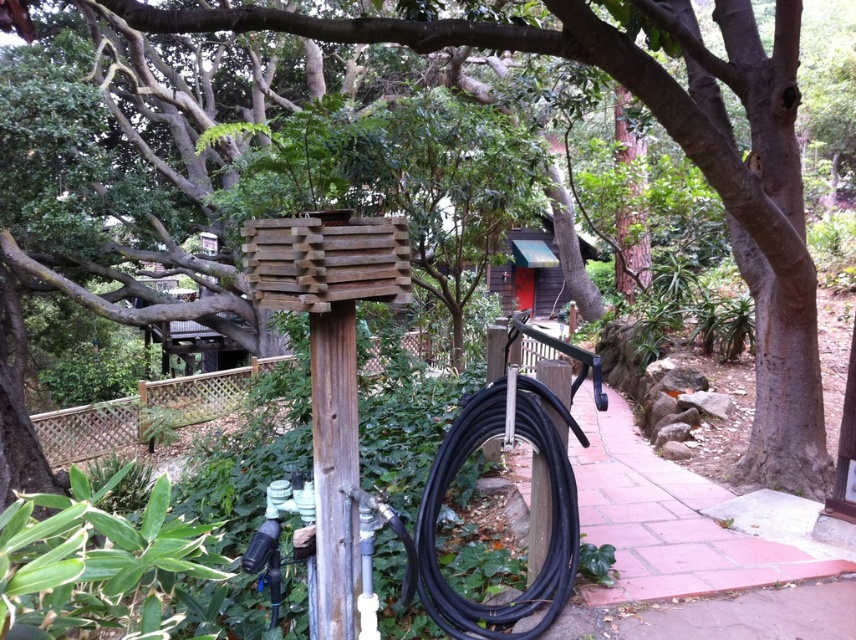
You are a gardener trying to determine which object is wider between the black rubber hose at center and the brown rough wood pole at center. Based on the scene, can you tell which one is wider?

The black rubber hose at center might be wider than brown rough wood pole at center.

Consider the image. You are a gardener who needs to reach the black rubber hose at center to water plants. You are currently standing 5 feet away from the brown rough wood pole at center. Can you reach the hose without moving closer to the pole?

The black rubber hose at center is 31.54 inches away from the brown rough wood pole at center. Since you are 5 feet away from the pole, you are approximately 60 inches away from the pole. The distance between you and the hose would be 60 inches minus 31.54 inches, which is about 28.46 inches. This distance is manageable for most people to reach without needing to move closer.